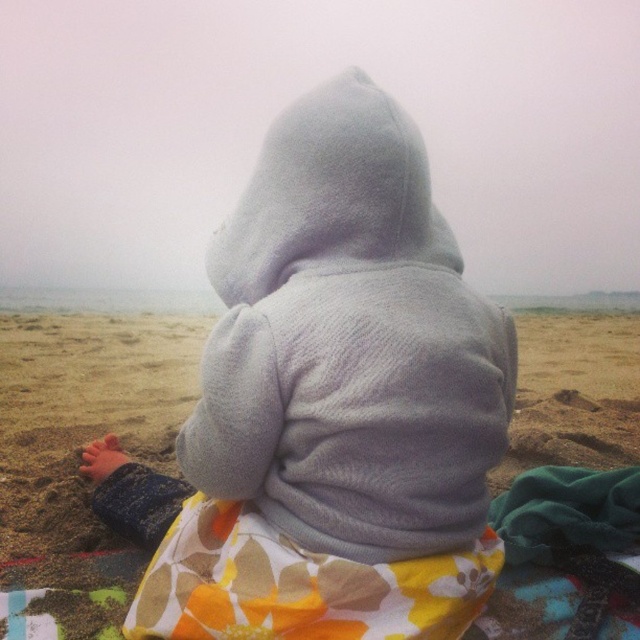
Who is taller, gray fleece hoodie at center or printed cotton blanket at center?

gray fleece hoodie at center

How much distance is there between gray fleece hoodie at center and printed cotton blanket at center?

They are 7.76 inches apart.

Is point (243, 353) less distant than point (412, 586)?

No, it is not.

This screenshot has height=640, width=640. Identify the location of gray fleece hoodie at center. (349, 342).

Can you confirm if gray fleece hoodie at center is taller than soft sand at center?

No.

Does point (273, 209) come closer to viewer compared to point (552, 435)?

Yes, point (273, 209) is in front of point (552, 435).

This screenshot has height=640, width=640. Find the location of `gray fleece hoodie at center`. gray fleece hoodie at center is located at coordinates (349, 342).

Looking at this image, does soft sand at center have a larger size compared to printed cotton blanket at center?

Yes, soft sand at center is bigger than printed cotton blanket at center.

Between soft sand at center and printed cotton blanket at center, which one appears on the left side from the viewer's perspective?

Positioned to the left is printed cotton blanket at center.

The width and height of the screenshot is (640, 640). In order to click on soft sand at center in this screenshot , I will do `click(80, 449)`.